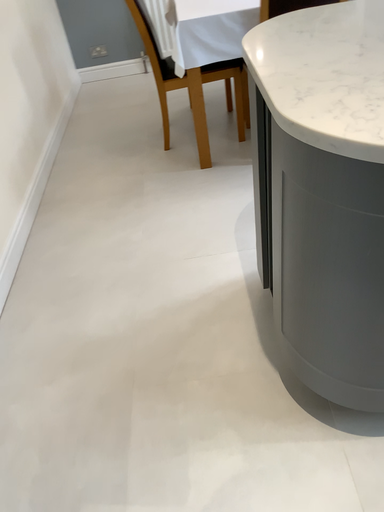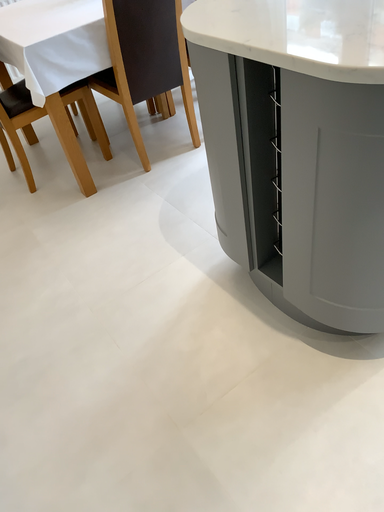
Question: How did the camera likely rotate when shooting the video?

Choices:
 (A) rotated right
 (B) rotated left

Answer: (A)